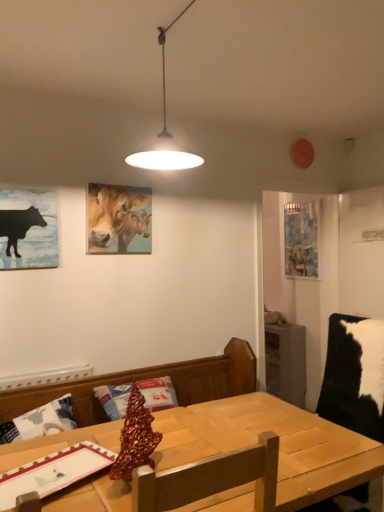
The width and height of the screenshot is (384, 512). Describe the element at coordinates (28, 229) in the screenshot. I see `black paper at left, the 1th picture frame positioned from the front` at that location.

Locate an element on the screen. This screenshot has width=384, height=512. wooden table at center is located at coordinates (279, 444).

This screenshot has width=384, height=512. Identify the location of black paper at left, the third picture frame positioned from the back. (28, 229).

This screenshot has height=512, width=384. Find the location of `picture frame above the black paper at left, the third picture frame positioned from the back (from a real-world perspective)`. picture frame above the black paper at left, the third picture frame positioned from the back (from a real-world perspective) is located at coordinates (119, 219).

How many degrees apart are the facing directions of oil painting of cows at upper center, arranged as the 2th picture frame when viewed from the right, and black paper at left, the 1th picture frame positioned from the front?

They differ by 0.0115 degrees in their facing directions.

Is oil painting of cows at upper center, arranged as the 2th picture frame when viewed from the front, to the left or to the right of black paper at left, the third picture frame positioned from the back, in the image?

oil painting of cows at upper center, arranged as the 2th picture frame when viewed from the front, is to the right of black paper at left, the third picture frame positioned from the back.

How much distance is there between black paper at left, which ranks as the third picture frame in right-to-left order, and wooden table at center?

black paper at left, which ranks as the third picture frame in right-to-left order, and wooden table at center are 35.11 inches apart.

Does black paper at left, the 1th picture frame positioned from the front, have a lesser height compared to wooden table at center?

Yes.

Is point (4, 193) behind point (16, 396)?

Yes, point (4, 193) is farther from viewer.

From a real-world perspective, relative to wooden table at center, is black paper at left, the third picture frame positioned from the back, vertically above or below?

black paper at left, the third picture frame positioned from the back, is situated higher than wooden table at center in the real world.

Considering the sizes of objects oil painting of cows at upper center, arranged as the 2th picture frame when viewed from the right, and wooden table at center in the image provided, who is shorter, oil painting of cows at upper center, arranged as the 2th picture frame when viewed from the right, or wooden table at center?

oil painting of cows at upper center, arranged as the 2th picture frame when viewed from the right, is shorter.

Between point (105, 237) and point (176, 417), which one is positioned behind?

The point (105, 237) is farther from the camera.

Can you confirm if oil painting of cows at upper center, the 2th picture frame viewed from the left, is wider than wooden table at center?

No.

Is oil painting of cows at upper center, the 2th picture frame viewed from the left, next to wooden table at center and touching it?

No, oil painting of cows at upper center, the 2th picture frame viewed from the left, is not next to wooden table at center.

Which is behind, point (1, 419) or point (47, 204)?

The point (47, 204) is farther from the camera.

Is black paper at left, which ranks as the third picture frame in right-to-left order, at the back of wooden table at center?

No, black paper at left, which ranks as the third picture frame in right-to-left order, is not at the back of wooden table at center.

Starting from the wooden table at center, which picture frame is the 1st one behind? Please provide its 2D coordinates.

[(28, 229)]

Between wooden table at center and black paper at left, which ranks as the third picture frame in right-to-left order, which one has larger width?

Wider between the two is wooden table at center.

Is point (247, 430) positioned behind point (300, 219)?

That is False.

Image resolution: width=384 pixels, height=512 pixels. Identify the location of table on the left of blue fabric picture frame at right, which ranks as the first picture frame in back-to-front order. (279, 444).

Considering the relative positions of wooden table at center and blue fabric picture frame at right, which ranks as the first picture frame in back-to-front order, in the image provided, is wooden table at center to the left of blue fabric picture frame at right, which ranks as the first picture frame in back-to-front order, from the viewer's perspective?

Yes, wooden table at center is to the left of blue fabric picture frame at right, which ranks as the first picture frame in back-to-front order.

Consider the image. From the image's perspective, does wooden table at center appear higher than blue fabric picture frame at right, which ranks as the first picture frame in back-to-front order?

Actually, wooden table at center appears below blue fabric picture frame at right, which ranks as the first picture frame in back-to-front order, in the image.

Considering the relative positions of wooden table at center and black paper at left, the third picture frame positioned from the back, in the image provided, is wooden table at center to the left of black paper at left, the third picture frame positioned from the back, from the viewer's perspective?

In fact, wooden table at center is to the right of black paper at left, the third picture frame positioned from the back.

Does wooden table at center have a lesser width compared to black paper at left, the first picture frame positioned from the left?

In fact, wooden table at center might be wider than black paper at left, the first picture frame positioned from the left.

Is black paper at left, the 1th picture frame positioned from the front, completely or partially inside wooden table at center?

That's incorrect, black paper at left, the 1th picture frame positioned from the front, is not inside wooden table at center.

Is wooden table at center far from black paper at left, which ranks as the third picture frame in right-to-left order?

Indeed, wooden table at center is not near black paper at left, which ranks as the third picture frame in right-to-left order.

Could you tell me if wooden table at center is turned towards wooden table at center?

No, wooden table at center does not turn towards wooden table at center.

Considering the relative sizes of wooden table at center and wooden table at center in the image provided, is wooden table at center smaller than wooden table at center?

No, wooden table at center is not smaller than wooden table at center.

I want to click on brown behind the wooden table at center, so click(146, 378).

Does wooden table at center lie in front of wooden table at center?

Yes, wooden table at center is in front of wooden table at center.

Where is `picture frame above the black paper at left, the first picture frame positioned from the left (from the image's perspective)`? The image size is (384, 512). picture frame above the black paper at left, the first picture frame positioned from the left (from the image's perspective) is located at coordinates (119, 219).

From the wooden table at center, count 1st picture frames backward and point to it. Please provide its 2D coordinates.

[(28, 229)]

Considering their positions, is oil painting of cows at upper center, arranged as the 2th picture frame when viewed from the front, positioned further to wooden table at center than blue fabric picture frame at right, the 3th picture frame from the front?

blue fabric picture frame at right, the 3th picture frame from the front, is further to wooden table at center.

Based on their spatial positions, is black paper at left, the third picture frame positioned from the back, or wooden table at center further from blue fabric picture frame at right, positioned as the first picture frame in right-to-left order?

Based on the image, black paper at left, the third picture frame positioned from the back, appears to be further to blue fabric picture frame at right, positioned as the first picture frame in right-to-left order.

Estimate the real-world distances between objects in this image. Which object is further from wooden table at center, wooden table at center or blue fabric picture frame at right, the 3th picture frame from the front?

blue fabric picture frame at right, the 3th picture frame from the front.

Based on their spatial positions, is black paper at left, the third picture frame positioned from the back, or blue fabric picture frame at right, the 3th picture frame from the front, further from wooden table at center?

blue fabric picture frame at right, the 3th picture frame from the front.

Which object lies nearer to the anchor point black paper at left, the 1th picture frame positioned from the front, blue fabric picture frame at right, the 3th picture frame from the front, or wooden table at center?

Based on the image, wooden table at center appears to be nearer to black paper at left, the 1th picture frame positioned from the front.

Which object lies further to the anchor point blue fabric picture frame at right, the 3th picture frame from the front, wooden table at center or black paper at left, the third picture frame positioned from the back?

black paper at left, the third picture frame positioned from the back, is positioned further to the anchor blue fabric picture frame at right, the 3th picture frame from the front.

Based on their spatial positions, is black paper at left, the 1th picture frame positioned from the front, or oil painting of cows at upper center, the 2th picture frame viewed from the left, closer to blue fabric picture frame at right, which ranks as the first picture frame in back-to-front order?

oil painting of cows at upper center, the 2th picture frame viewed from the left, is positioned closer to the anchor blue fabric picture frame at right, which ranks as the first picture frame in back-to-front order.

When comparing their distances from oil painting of cows at upper center, arranged as the 2th picture frame when viewed from the front, does wooden table at center or wooden table at center seem closer?

Among the two, wooden table at center is located nearer to oil painting of cows at upper center, arranged as the 2th picture frame when viewed from the front.

What are the coordinates of `brown between wooden table at center and black paper at left, which ranks as the third picture frame in right-to-left order, along the z-axis` in the screenshot? It's located at [146, 378].

Where is `picture frame located between black paper at left, the 1th picture frame positioned from the front, and blue fabric picture frame at right, which ranks as the first picture frame in back-to-front order, in the left-right direction`? picture frame located between black paper at left, the 1th picture frame positioned from the front, and blue fabric picture frame at right, which ranks as the first picture frame in back-to-front order, in the left-right direction is located at coordinates (119, 219).

You are a GUI agent. You are given a task and a screenshot of the screen. Output one action in this format:
    pyautogui.click(x=<x>, y=<y>)
    Task: Click on the brown positioned between wooden table at center and blue fabric picture frame at right, which ranks as the first picture frame in back-to-front order, from near to far
    This screenshot has height=512, width=384.
    Given the screenshot: What is the action you would take?
    pyautogui.click(x=146, y=378)

At what (x,y) coordinates should I click in order to perform the action: click on picture frame positioned between wooden table at center and oil painting of cows at upper center, arranged as the 2th picture frame when viewed from the right, from near to far. Please return your answer as a coordinate pair (x, y). The height and width of the screenshot is (512, 384). Looking at the image, I should click on (28, 229).